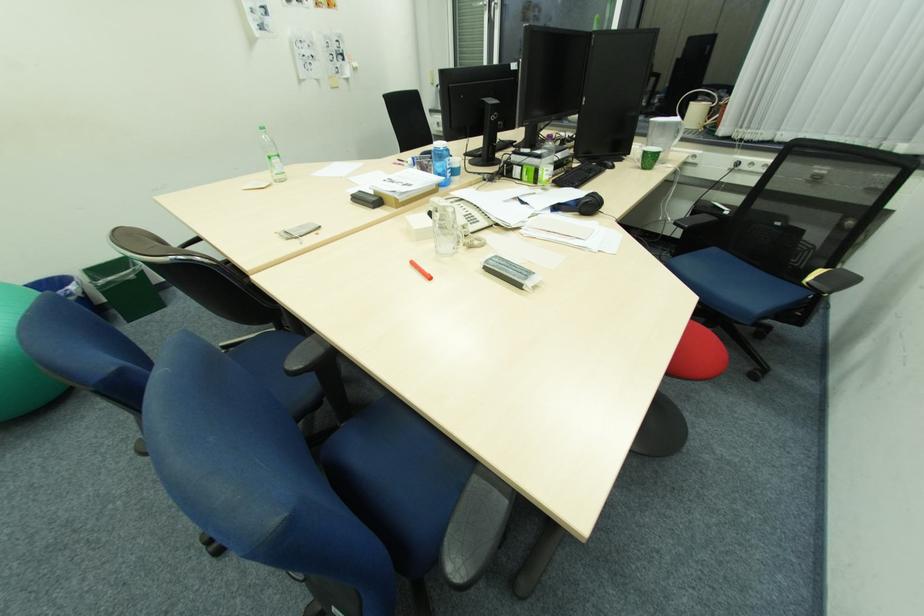
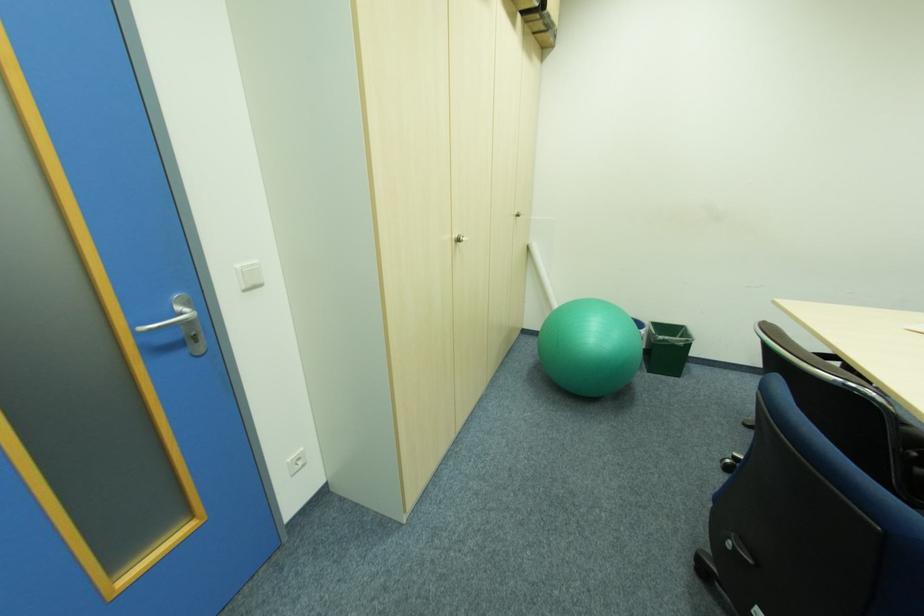
Where in the second image is the point corresponding to pixel 134 323 from the first image?

(653, 371)